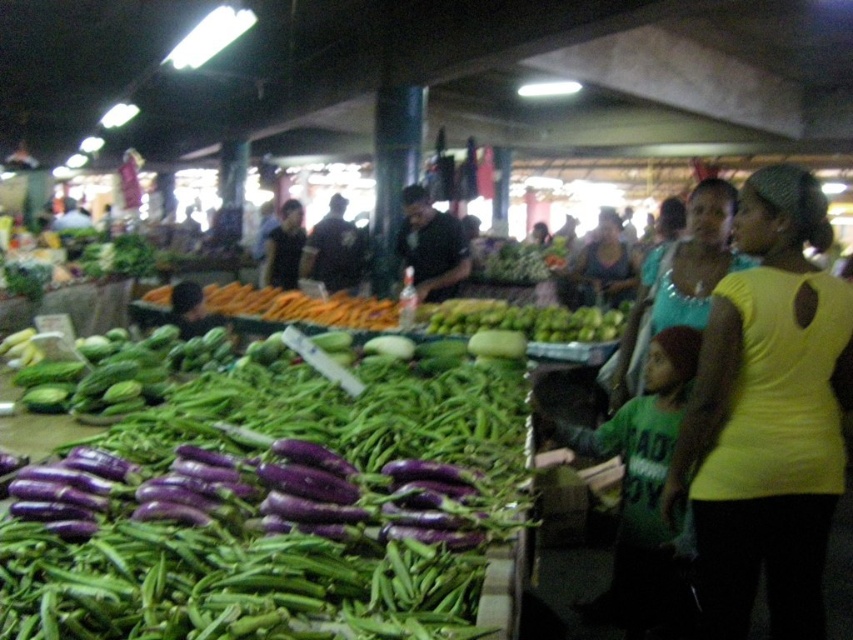
You are a vendor at the market and need to decide which clothing item to display first. The yellow matte shirt at right and the teal fabric top at center are both on the same rack. Based on their width, which one should you hang first to ensure they both fit on the rack?

The yellow matte shirt at right might be wider than teal fabric top at center, so you should hang the teal fabric top at center first to ensure both items can fit on the rack.

You are a photographer trying to capture both the yellow matte shirt at right and the teal fabric top at center in the same frame. However, your camera can only focus on one subject at a time. Which subject should you focus on to ensure the other remains visible but slightly blurred?

You should focus on the yellow matte shirt at right because it is in front of the teal fabric top at center, so focusing on the closer subject will keep the background subject slightly blurred while still visible.